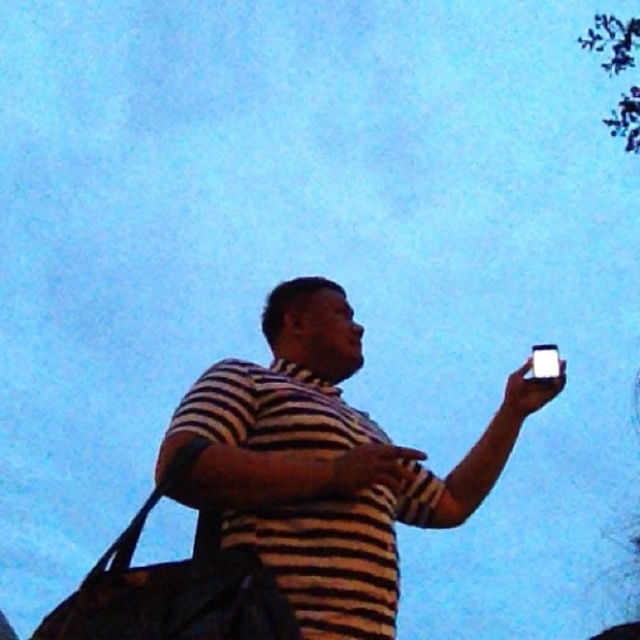
Question: Can you confirm if striped fabric shirt at center is positioned below white glossy smartphone at upper right?

Choices:
 (A) no
 (B) yes

Answer: (B)

Question: Is striped fabric shirt at center smaller than white glossy smartphone at upper right?

Choices:
 (A) no
 (B) yes

Answer: (A)

Question: Is striped fabric shirt at center wider than white glossy smartphone at upper right?

Choices:
 (A) yes
 (B) no

Answer: (A)

Question: Which point is farther to the camera?

Choices:
 (A) striped fabric shirt at center
 (B) white glossy smartphone at upper right

Answer: (B)

Question: Among these objects, which one is farthest from the camera?

Choices:
 (A) white glossy smartphone at upper right
 (B) striped fabric shirt at center

Answer: (A)